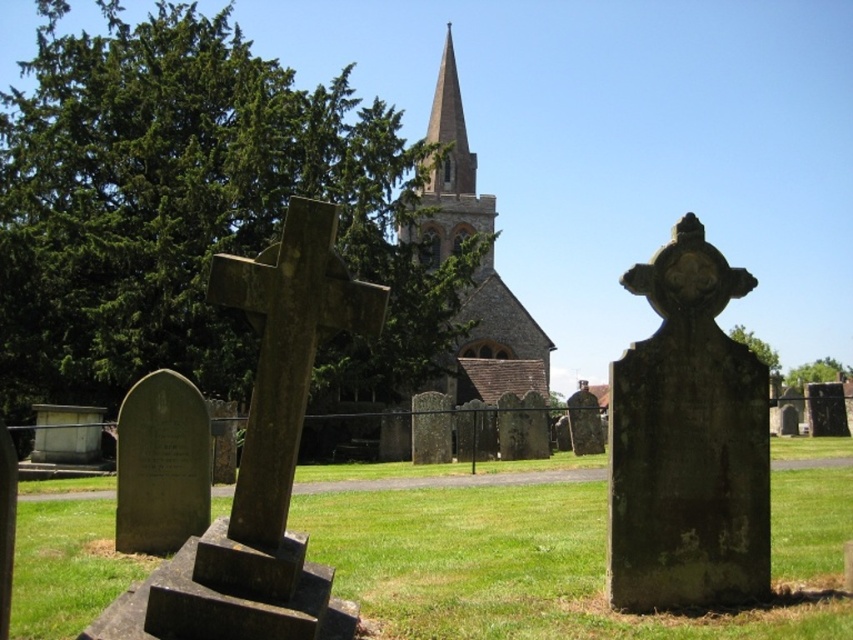
Who is taller, brown stone cross at center or smooth stone church steeple at center?

With more height is smooth stone church steeple at center.

Find the location of a particular element. The width and height of the screenshot is (853, 640). brown stone cross at center is located at coordinates (286, 352).

Is point (281, 300) farther from camera compared to point (479, 321)?

No, (281, 300) is closer to viewer.

Locate an element on the screen. Image resolution: width=853 pixels, height=640 pixels. brown stone cross at center is located at coordinates (286, 352).

What do you see at coordinates (286, 352) in the screenshot? The width and height of the screenshot is (853, 640). I see `brown stone cross at center` at bounding box center [286, 352].

Does brown stone cross at center lie in front of brown stone spire at center?

That is True.

Locate an element on the screen. brown stone cross at center is located at coordinates [286, 352].

Locate an element on the screen. Image resolution: width=853 pixels, height=640 pixels. brown stone cross at center is located at coordinates (286, 352).

Is green grass at center to the left of smooth stone church steeple at center from the viewer's perspective?

No, green grass at center is not to the left of smooth stone church steeple at center.

Does green grass at center have a larger size compared to smooth stone church steeple at center?

No, green grass at center is not bigger than smooth stone church steeple at center.

Between point (305, 470) and point (434, 184), which one is positioned in front?

Point (305, 470) is more forward.

Image resolution: width=853 pixels, height=640 pixels. I want to click on green grass at center, so click(x=503, y=566).